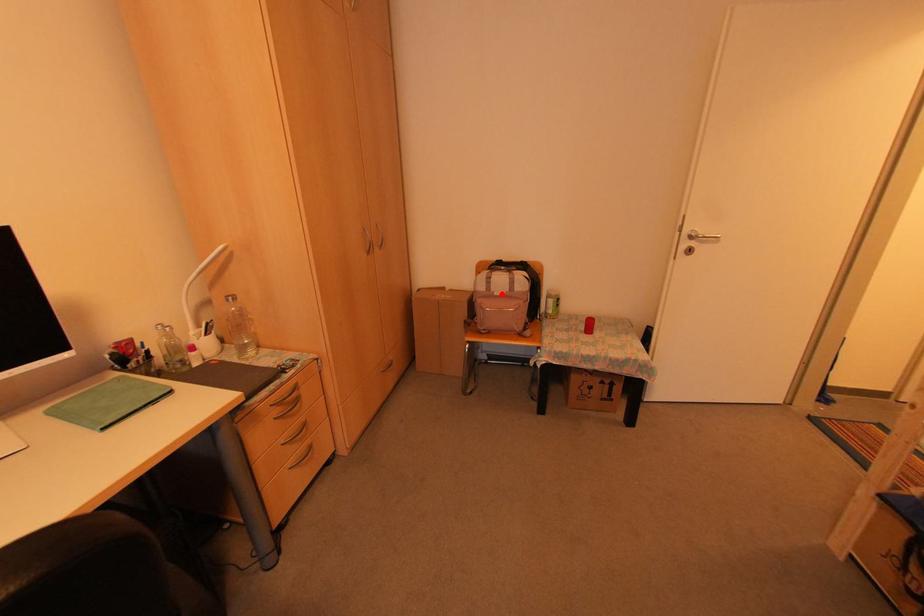
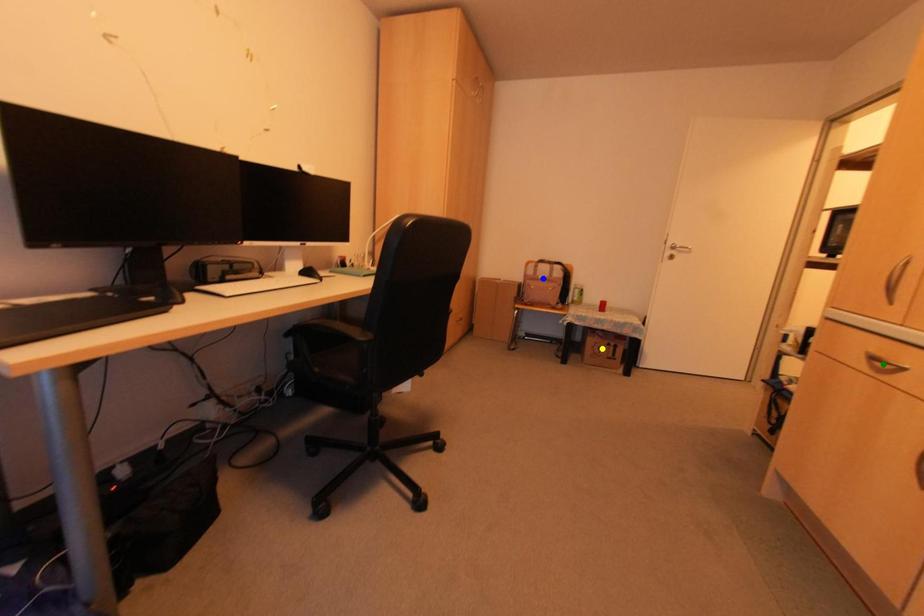
Question: I am providing you with two images of the same scene from different viewpoints. A red point is marked on the first image. You are given multiple points on the second image. Which spot in image 2 lines up with the point in image 1?

Choices:
 (A) green point
 (B) blue point
 (C) yellow point

Answer: (B)